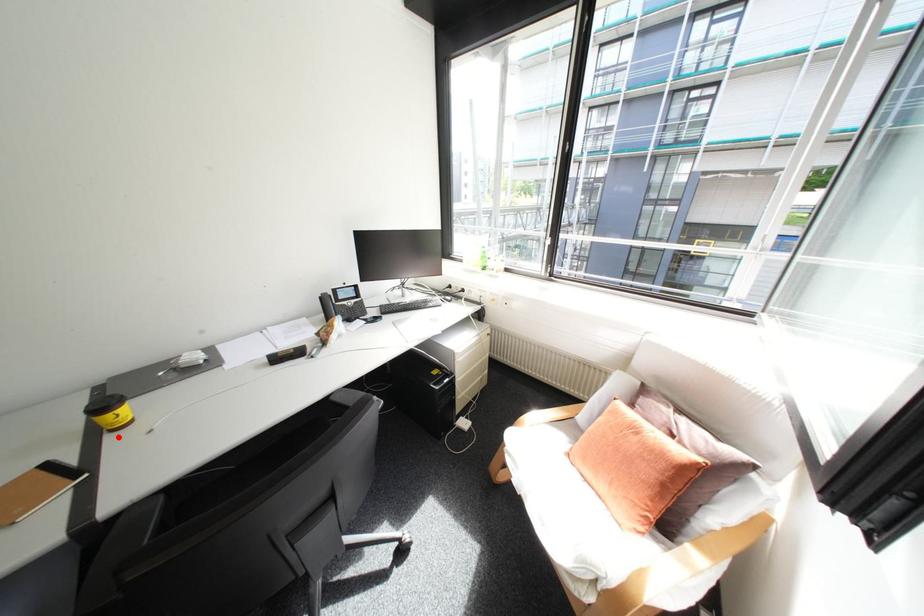
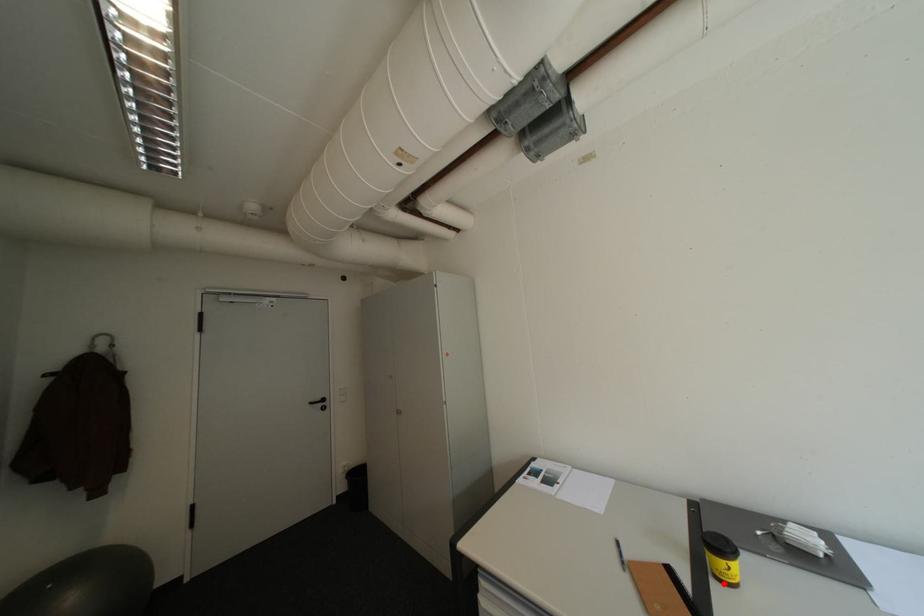
I am providing you with two images of the same scene from different viewpoints. A red point is marked on the first image and another point is marked on the second image. Is the marked point in image1 the same physical position as the marked point in image2?

Yes